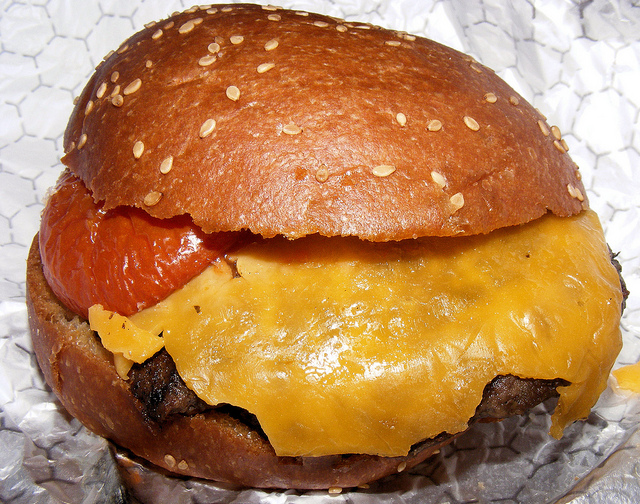
Identify the location of countertop. (67, 424).